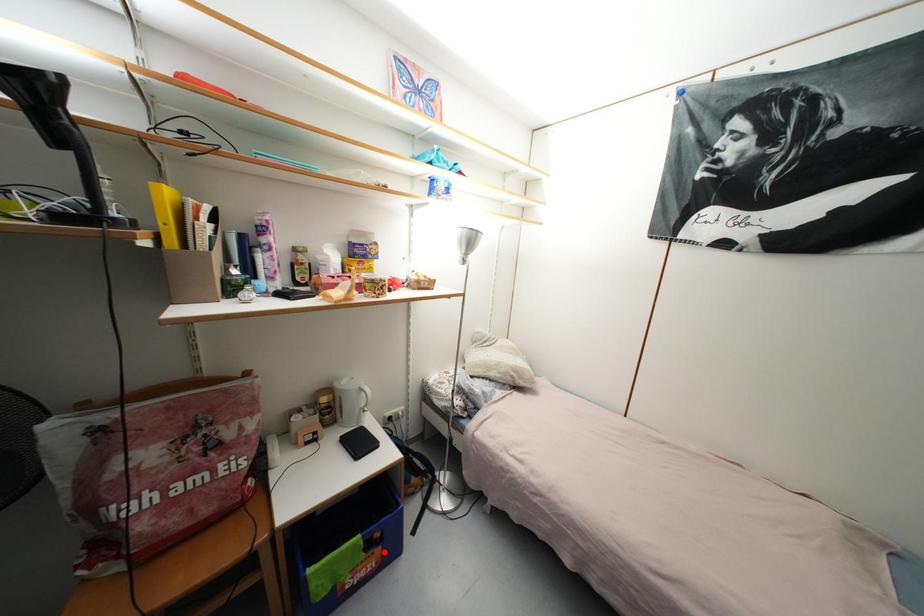
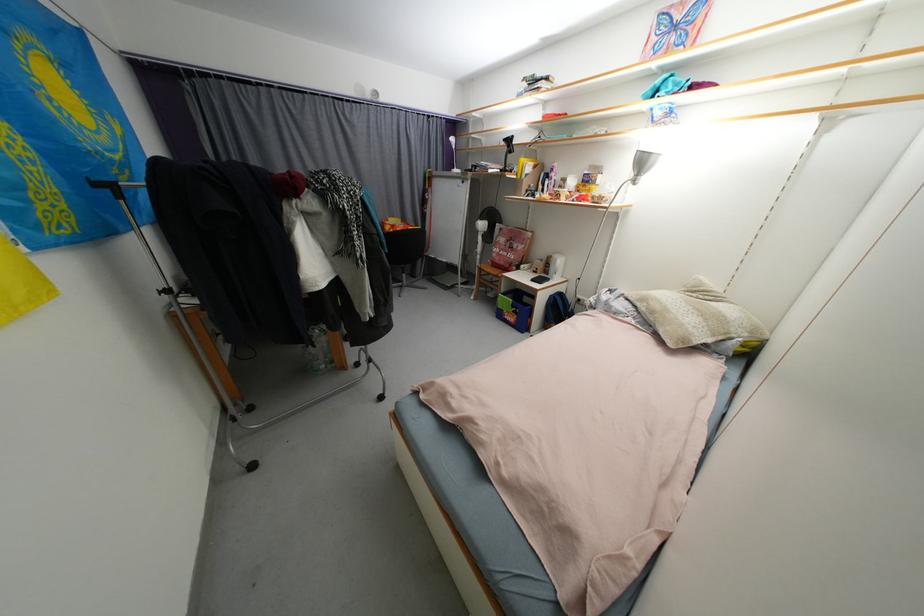
Question: I am providing you with two images of the same scene from different viewpoints. Given a red point in image1, look at the same physical point in image2. Is it:

Choices:
 (A) Closer to the viewpoint
 (B) Farther from the viewpoint

Answer: (A)